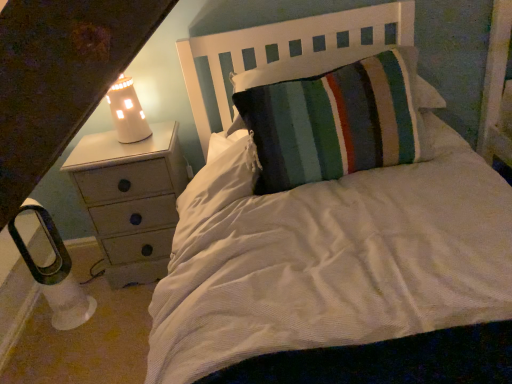
Question: From the image's perspective, is white wood headboard at upper center located above or below white painted wood chest of drawers at left?

Choices:
 (A) below
 (B) above

Answer: (B)

Question: Is white wood headboard at upper center situated inside white painted wood chest of drawers at left or outside?

Choices:
 (A) outside
 (B) inside

Answer: (A)

Question: Considering the real-world distances, which object is farthest from the white ceramic lamp at upper left, the 2th lamp ordered from the bottom?

Choices:
 (A) white wood headboard at upper center
 (B) white plastic lamp at lower left, the 2th lamp positioned from the right
 (C) white painted wood chest of drawers at left

Answer: (B)

Question: Estimate the real-world distances between objects in this image. Which object is closer to the white plastic lamp at lower left, the 2th lamp positioned from the right?

Choices:
 (A) white ceramic lamp at upper left, positioned as the 1th lamp in top-to-bottom order
 (B) white wood headboard at upper center
 (C) white painted wood chest of drawers at left

Answer: (C)